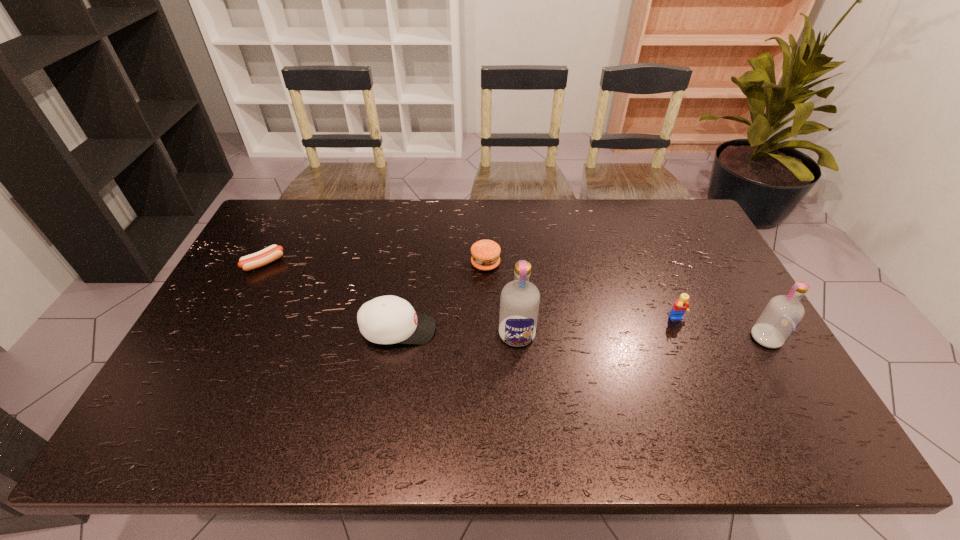
Considering the uniform spacing of vodkas, where should an additional vodka be positioned on the left? Please locate a free spot. Please provide its 2D coordinates. Your answer should be formatted as a tuple, i.e. [(x, y)], where the tuple contains the x and y coordinates of a point satisfying the conditions above.

[(272, 330)]